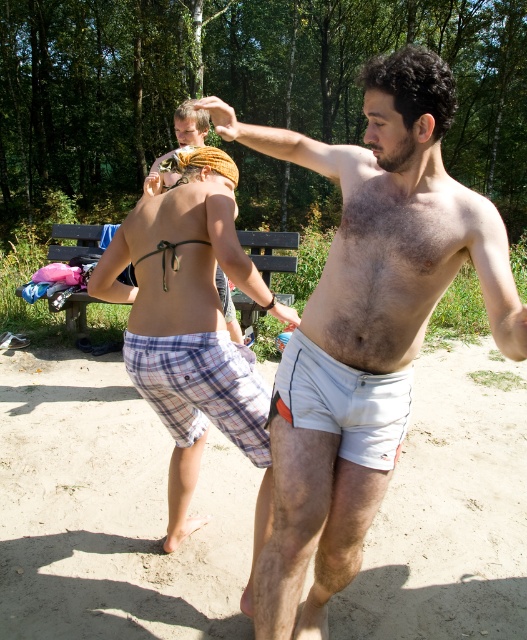
Question: Which object is closer to the camera taking this photo?

Choices:
 (A) plaid fabric shorts at center
 (B) plaid shorts at center
 (C) white sandy beach at lower center
 (D) white cotton shorts at right

Answer: (D)

Question: Does white cotton shorts at right appear under plaid shorts at center?

Choices:
 (A) no
 (B) yes

Answer: (B)

Question: Can you confirm if white cotton shorts at center is positioned to the right of plaid shorts at center?

Choices:
 (A) yes
 (B) no

Answer: (A)

Question: Is white cotton shorts at right positioned in front of plaid shorts at center?

Choices:
 (A) yes
 (B) no

Answer: (A)

Question: Which point is farther from the camera taking this photo?

Choices:
 (A) (190, 352)
 (B) (161, 340)
 (C) (144, 529)

Answer: (C)

Question: Which point appears closest to the camera in this image?

Choices:
 (A) (467, 577)
 (B) (179, 442)
 (C) (240, 337)
 (D) (181, 300)

Answer: (D)